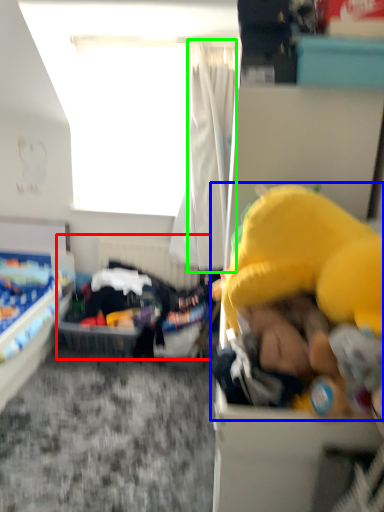
Question: Considering the real-world distances, which object is farthest from infant bed (highlighted by a red box)? toy (highlighted by a blue box) or curtain (highlighted by a green box)?

Choices:
 (A) toy
 (B) curtain

Answer: (A)